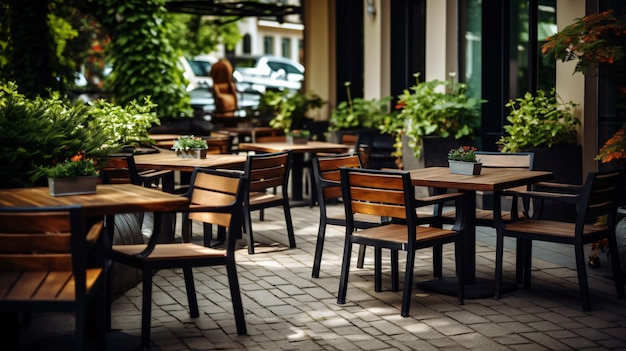
I want to click on chairs, so click(66, 277), click(183, 245), click(372, 230), click(272, 177), click(331, 164), click(544, 230).